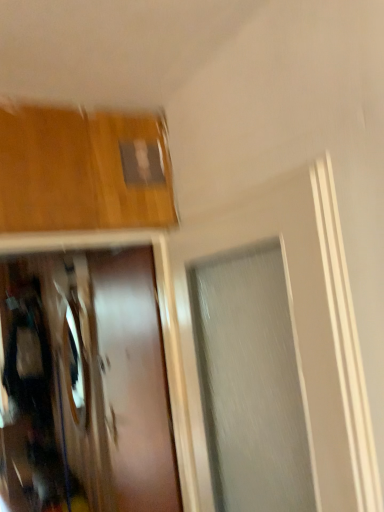
Question: Considering the positions of satin brown door at center and shiny silver mirror at left in the image, is satin brown door at center bigger or smaller than shiny silver mirror at left?

Choices:
 (A) small
 (B) big

Answer: (B)

Question: Based on their positions, is satin brown door at center located to the left or right of shiny silver mirror at left?

Choices:
 (A) right
 (B) left

Answer: (A)

Question: From their relative heights in the image, would you say satin brown door at center is taller or shorter than shiny silver mirror at left?

Choices:
 (A) tall
 (B) short

Answer: (A)

Question: In terms of height, does shiny silver mirror at left look taller or shorter compared to satin brown door at center?

Choices:
 (A) short
 (B) tall

Answer: (A)

Question: Considering the positions of shiny silver mirror at left and satin brown door at center in the image, is shiny silver mirror at left wider or thinner than satin brown door at center?

Choices:
 (A) thin
 (B) wide

Answer: (A)

Question: Does point (72, 329) appear closer or farther from the camera than point (107, 340)?

Choices:
 (A) farther
 (B) closer

Answer: (A)

Question: From a real-world perspective, is shiny silver mirror at left positioned above or below satin brown door at center?

Choices:
 (A) below
 (B) above

Answer: (B)